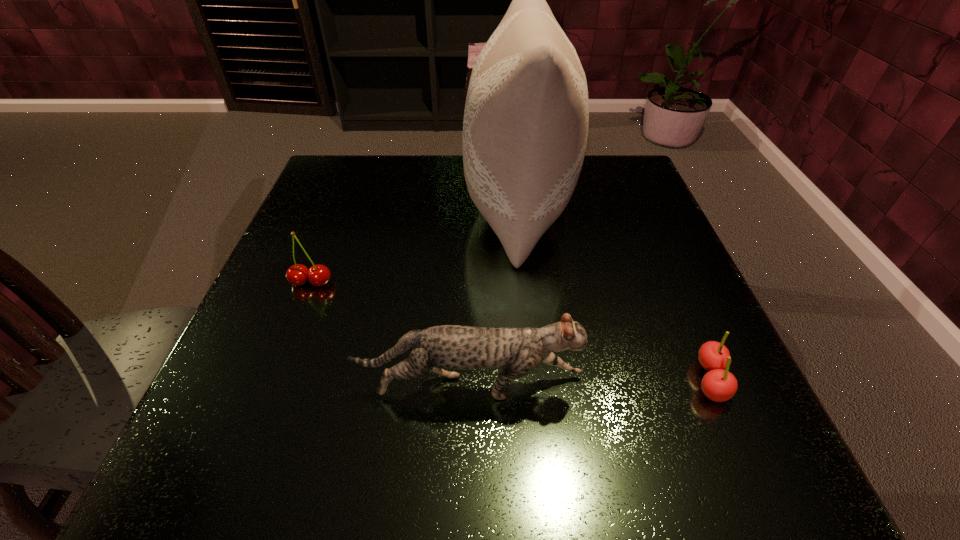
Locate an element on the screen. Image resolution: width=960 pixels, height=540 pixels. vacant space located with the stems of the leftmost object pointing upwards is located at coordinates (233, 483).

Locate an element on the screen. Image resolution: width=960 pixels, height=540 pixels. vacant space located on the back of the shortest object is located at coordinates click(657, 258).

Locate an element on the screen. This screenshot has width=960, height=540. object that is at the far edge is located at coordinates (525, 128).

At what (x,y) coordinates should I click in order to perform the action: click on object located in the left edge section of the desktop. Please return your answer as a coordinate pair (x, y). The height and width of the screenshot is (540, 960). Looking at the image, I should click on (319, 275).

This screenshot has width=960, height=540. In order to click on object present at the right edge in this screenshot , I will do `click(718, 384)`.

The image size is (960, 540). Identify the location of free space at the far edge of the desktop. (441, 168).

Identify the location of free region at the near edge of the desktop. (538, 476).

The width and height of the screenshot is (960, 540). I want to click on vacant space at the left edge of the desktop, so click(x=323, y=233).

I want to click on vacant space at the right edge of the desktop, so coord(658,410).

What are the coordinates of `blank area at the far right corner` in the screenshot? It's located at (629, 204).